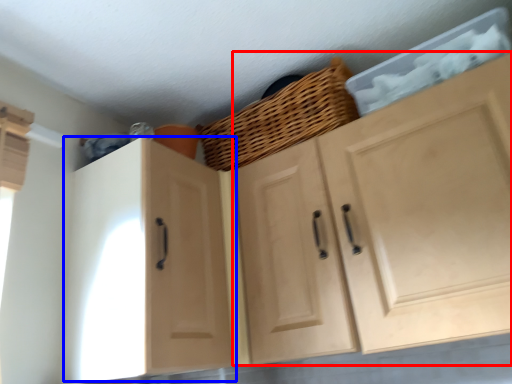
Question: Which of the following is the farthest to the observer, cabinetry (highlighted by a red box) or cabinetry (highlighted by a blue box)?

Choices:
 (A) cabinetry
 (B) cabinetry

Answer: (B)